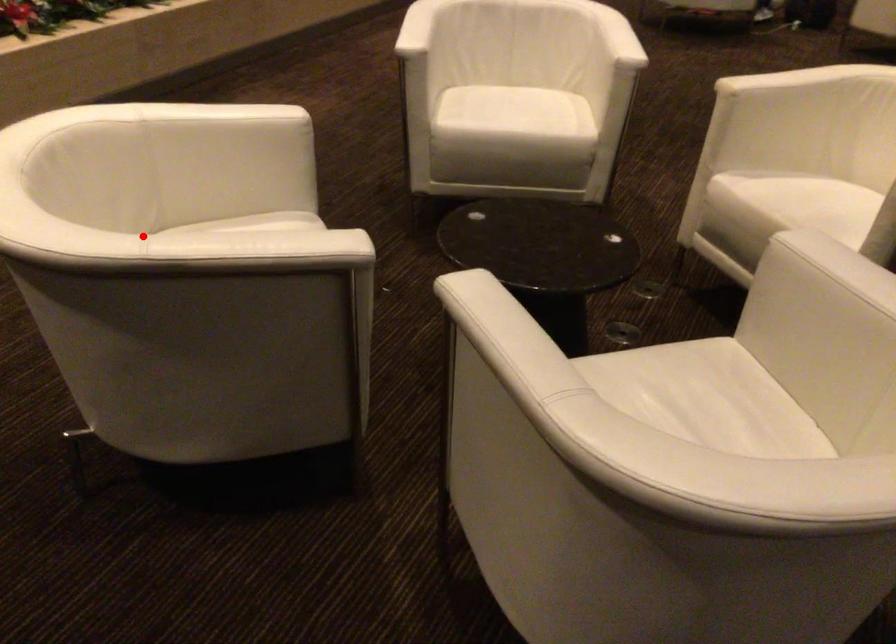
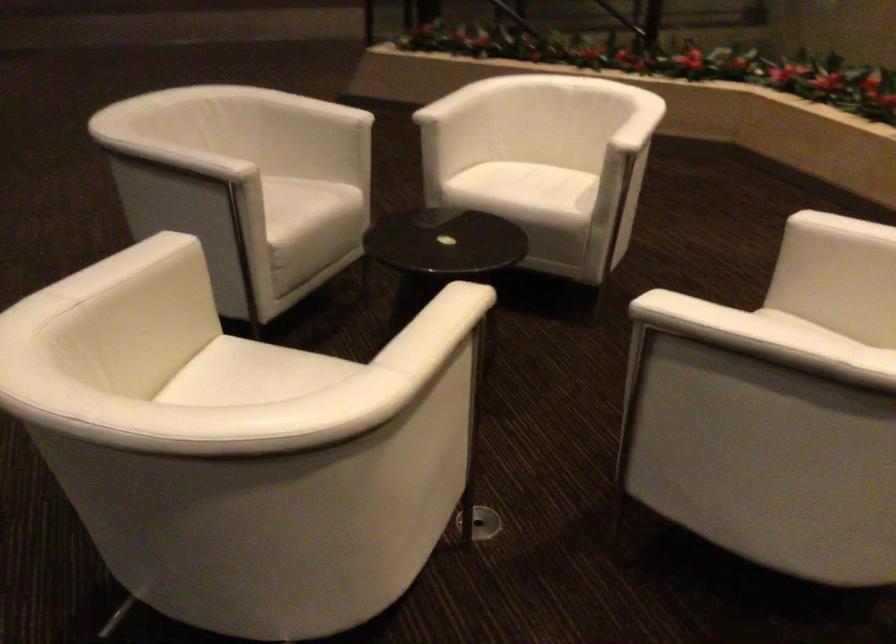
Question: I am providing you with two images of the same scene from different viewpoints. A red point is shown in image1. For the corresponding object point in image2, is it positioned nearer or farther from the camera?

Choices:
 (A) Nearer
 (B) Farther

Answer: (B)